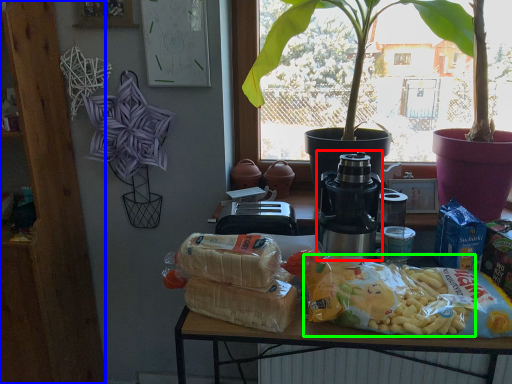
Question: Which is farther away from yoghurt (highlighted by a red box)? bookshelf (highlighted by a blue box) or food (highlighted by a green box)?

Choices:
 (A) bookshelf
 (B) food

Answer: (A)